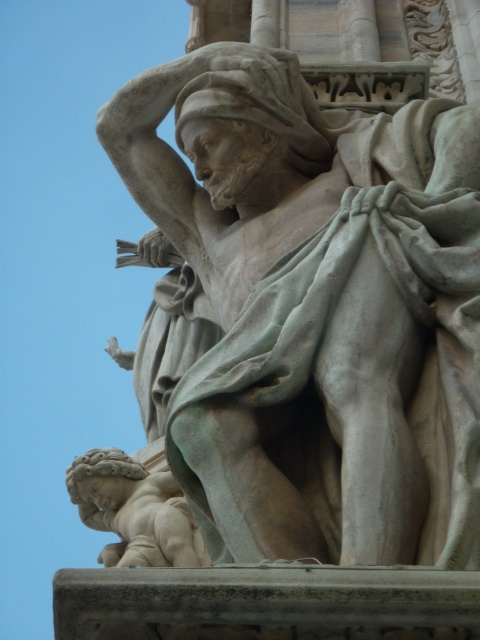
Is white marble statue at upper center to the left of smooth beige cherub at lower left from the viewer's perspective?

In fact, white marble statue at upper center is to the right of smooth beige cherub at lower left.

Between point (446, 192) and point (192, 548), which one is positioned in front?

Point (446, 192) is in front.

Is point (248, 544) positioned after point (115, 506)?

That is False.

Where is `white marble statue at upper center`? Image resolution: width=480 pixels, height=640 pixels. white marble statue at upper center is located at coordinates (316, 308).